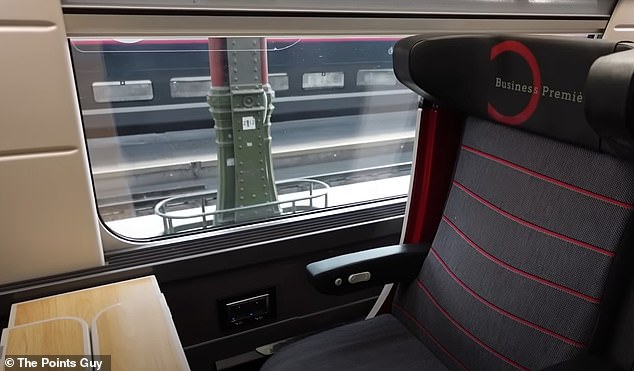
The height and width of the screenshot is (371, 634). What are the coordinates of `right table extension` in the screenshot? It's located at [x=143, y=335].